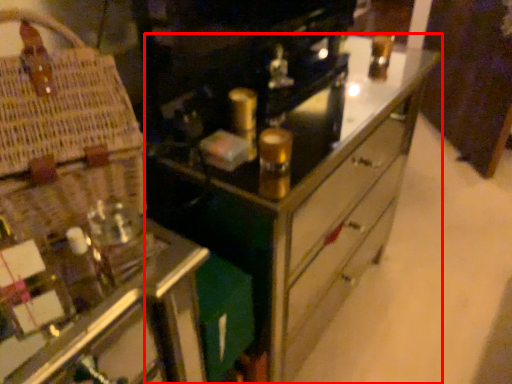
Question: Observing the image, what is the correct spatial positioning of chest of drawers (annotated by the red box) in reference to basket?

Choices:
 (A) right
 (B) left

Answer: (A)